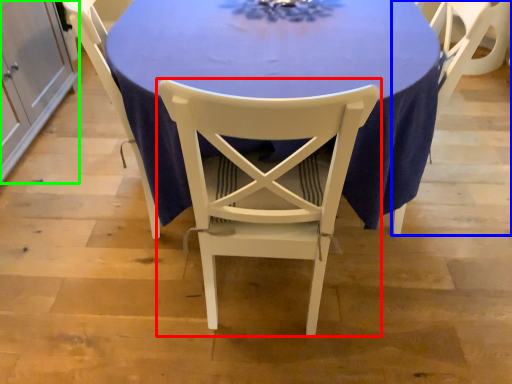
Question: Which is farther away from chair (highlighted by a red box)? chair (highlighted by a blue box) or cabinetry (highlighted by a green box)?

Choices:
 (A) chair
 (B) cabinetry

Answer: (B)